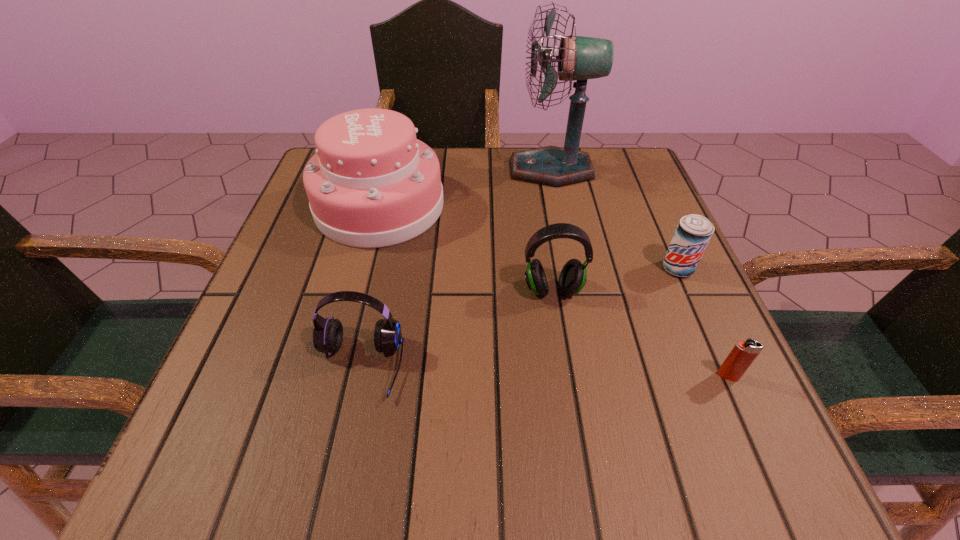
Where is `vacant space located on the ear cups of the right headset`? vacant space located on the ear cups of the right headset is located at coordinates (569, 396).

Locate an element on the screen. This screenshot has height=540, width=960. vacant area located on the ear cushions of the left headset is located at coordinates (338, 459).

The width and height of the screenshot is (960, 540). I want to click on free space located 0.120m on the left of the beer can, so click(x=599, y=268).

Find the location of a particular element. free region located 0.320m on the back of the shortest object is located at coordinates (665, 235).

Image resolution: width=960 pixels, height=540 pixels. I want to click on fan that is positioned at the far edge, so click(x=580, y=58).

Locate an element on the screen. Image resolution: width=960 pixels, height=540 pixels. birthday cake located at the far edge is located at coordinates (371, 184).

Locate an element on the screen. Image resolution: width=960 pixels, height=540 pixels. birthday cake that is positioned at the left edge is located at coordinates (371, 184).

Identify the location of headset present at the left edge. The height and width of the screenshot is (540, 960). (328, 333).

At what (x,y) coordinates should I click in order to perform the action: click on fan that is at the right edge. Please return your answer as a coordinate pair (x, y). Looking at the image, I should click on (580, 58).

This screenshot has height=540, width=960. Find the location of `beer can located at the right edge`. beer can located at the right edge is located at coordinates (693, 233).